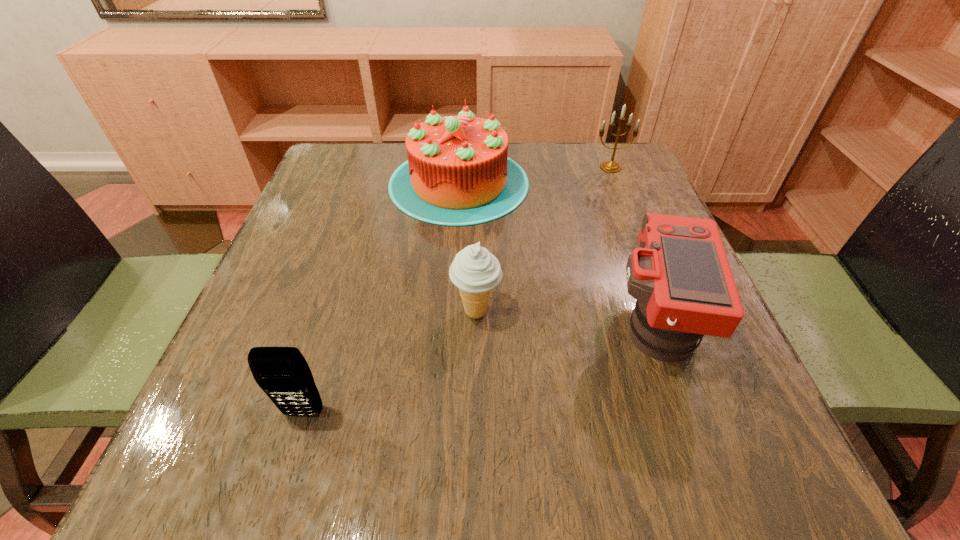
Image resolution: width=960 pixels, height=540 pixels. I want to click on free space between the icecream and the candelabrum, so click(x=543, y=239).

Locate an element on the screen. Image resolution: width=960 pixels, height=540 pixels. object that can be found as the fourth closest to the nearest object is located at coordinates (608, 166).

Select which object appears as the closest to the cellular telephone. Please provide its 2D coordinates. Your answer should be formatted as a tuple, i.e. [(x, y)], where the tuple contains the x and y coordinates of a point satisfying the conditions above.

[(475, 271)]

The image size is (960, 540). What are the coordinates of `free spot that satisfies the following two spatial constraints: 1. on the front side of the cake; 2. on the right side of the camera` in the screenshot? It's located at (450, 323).

This screenshot has width=960, height=540. Identify the location of blank area in the image that satisfies the following two spatial constraints: 1. on the back side of the candelabrum; 2. on the right side of the icecream. (477, 167).